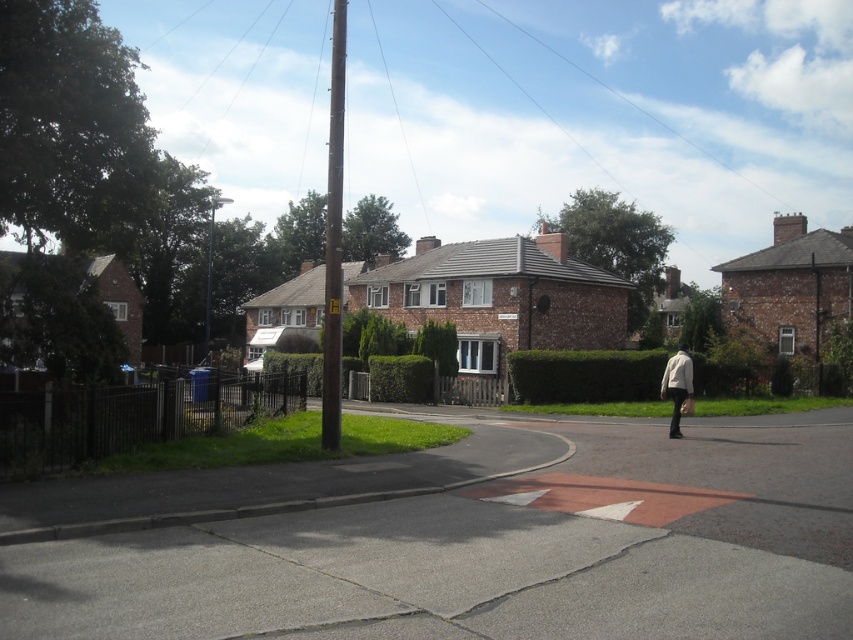
Question: Does brown wooden pole at center appear under light beige fabric jacket at center-right?

Choices:
 (A) no
 (B) yes

Answer: (A)

Question: Which object appears farthest from the camera in this image?

Choices:
 (A) brown wooden pole at center
 (B) light beige fabric jacket at center-right

Answer: (B)

Question: Is brown wooden pole at center further to camera compared to light beige fabric jacket at center-right?

Choices:
 (A) yes
 (B) no

Answer: (B)

Question: Is brown wooden pole at center positioned behind light beige fabric jacket at center-right?

Choices:
 (A) yes
 (B) no

Answer: (B)